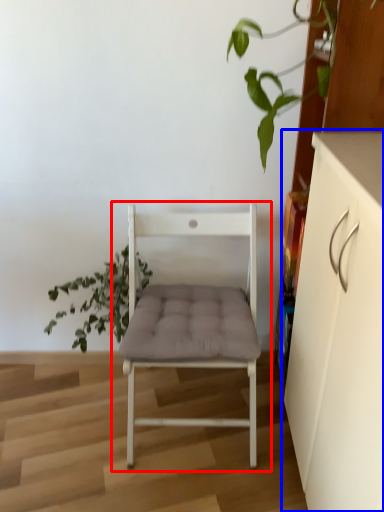
Question: Which object appears closest to the camera in this image, chair (highlighted by a red box) or cabinetry (highlighted by a blue box)?

Choices:
 (A) chair
 (B) cabinetry

Answer: (B)